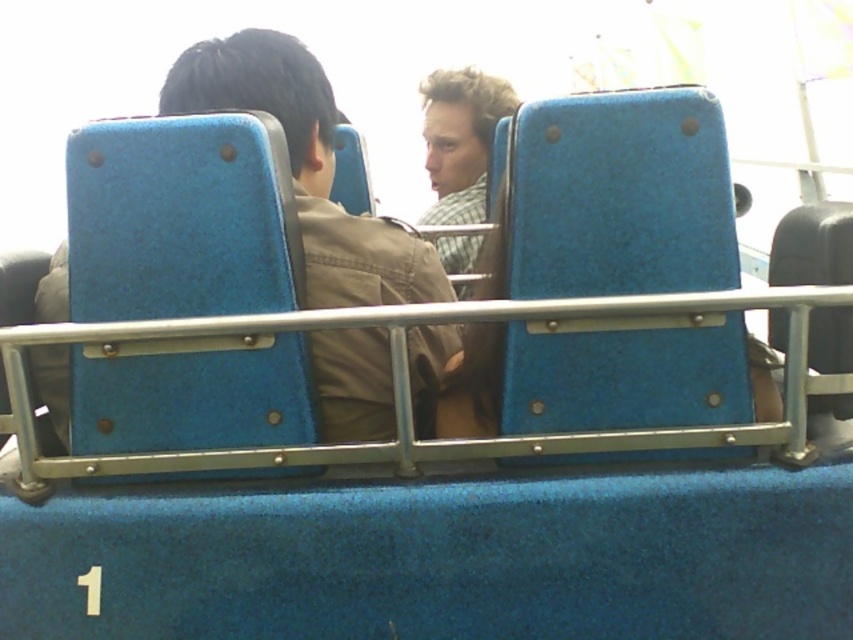
Question: Can you confirm if matte blue jacket at center is positioned to the left of checkered fabric shirt at center?

Choices:
 (A) no
 (B) yes

Answer: (B)

Question: Which point appears farthest from the camera in this image?

Choices:
 (A) (354, 385)
 (B) (467, 269)

Answer: (B)

Question: Does matte blue jacket at center have a greater width compared to checkered fabric shirt at center?

Choices:
 (A) no
 (B) yes

Answer: (B)

Question: Is matte blue jacket at center to the right of checkered fabric shirt at center from the viewer's perspective?

Choices:
 (A) no
 (B) yes

Answer: (A)